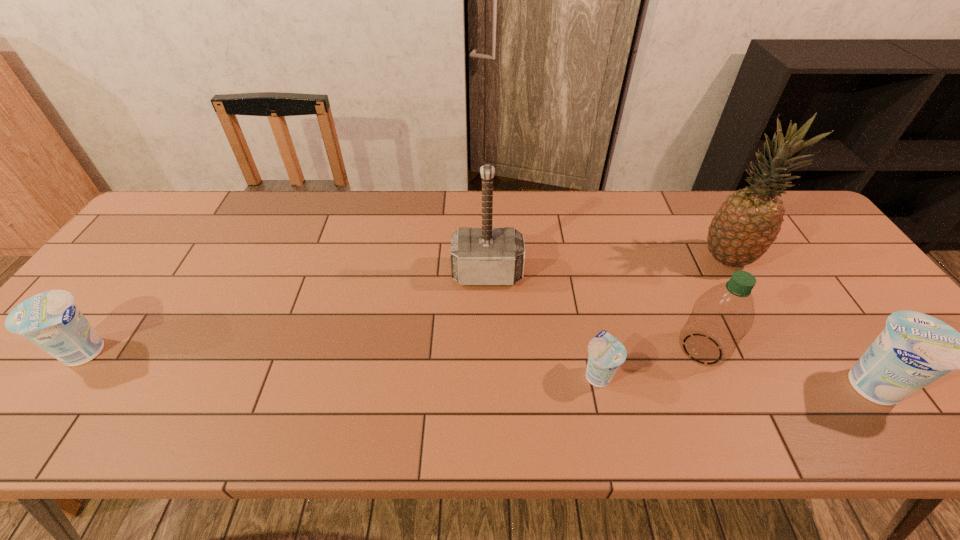
Please determine a free point for an extra yogurt to ensure balance. Please provide its 2D coordinates. Your answer should be formatted as a tuple, i.e. [(x, y)], where the tuple contains the x and y coordinates of a point satisfying the conditions above.

[(338, 362)]